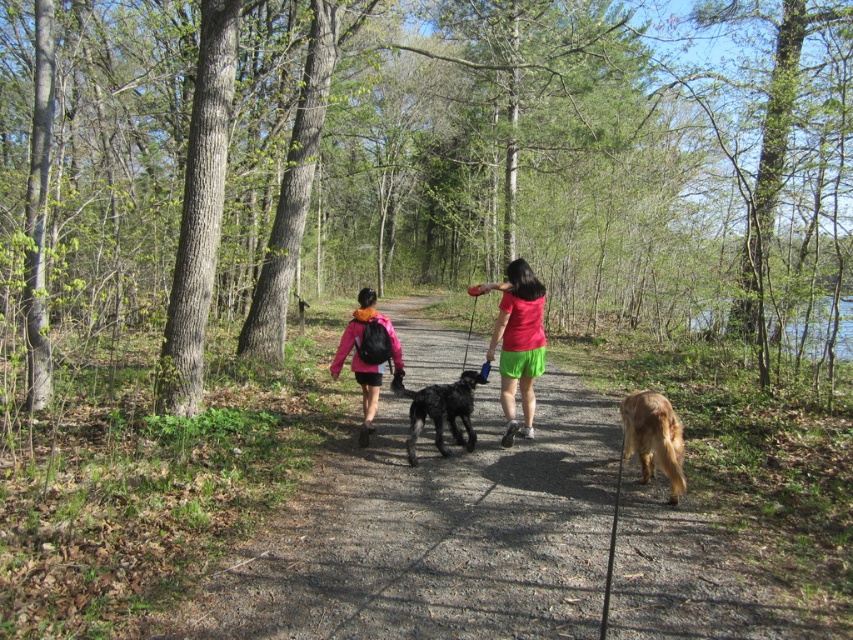
Question: Among these points, which one is farthest from the camera?

Choices:
 (A) click(506, 476)
 (B) click(467, 445)
 (C) click(364, 444)
 (D) click(526, 413)

Answer: (D)

Question: Can you confirm if pink fabric jacket at center is positioned to the left of shiny black dog at center?

Choices:
 (A) yes
 (B) no

Answer: (A)

Question: Estimate the real-world distances between objects in this image. Which object is closer to the pink fabric jacket at center?

Choices:
 (A) shiny black dog at center
 (B) matte pink shirt at center
 (C) golden fur dog at lower right
 (D) brown dirt path at center

Answer: (A)

Question: Does brown dirt path at center appear over golden fur dog at lower right?

Choices:
 (A) no
 (B) yes

Answer: (A)

Question: Which object appears closest to the camera in this image?

Choices:
 (A) shiny black dog at center
 (B) golden fur dog at lower right
 (C) matte pink shirt at center

Answer: (B)

Question: Does brown dirt path at center have a larger size compared to matte pink shirt at center?

Choices:
 (A) no
 (B) yes

Answer: (B)